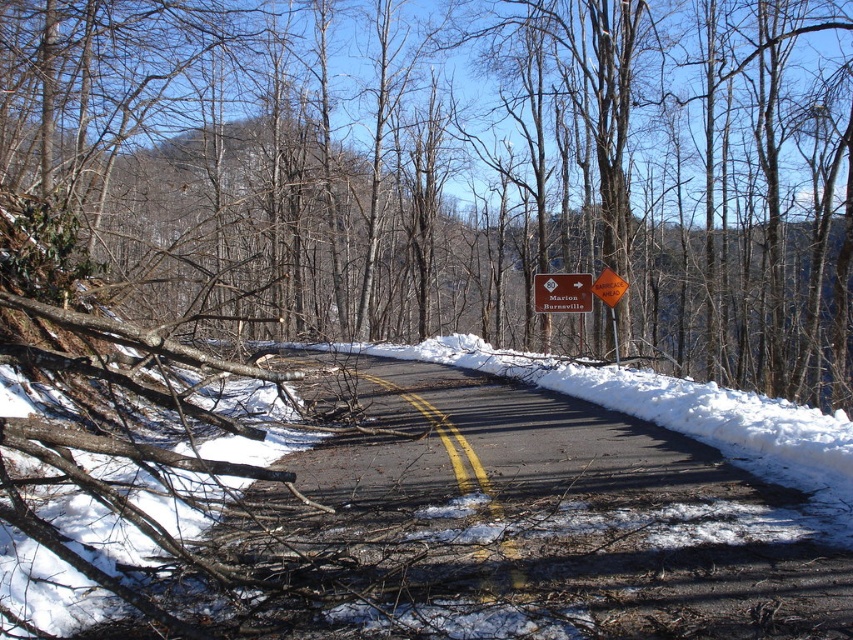
Based on the photo, does brown wooden sign at center have a lesser width compared to orange reflective diamond at center?

No.

Is point (573, 304) less distant than point (602, 291)?

No, (573, 304) is behind (602, 291).

Locate an element on the screen. The image size is (853, 640). brown wooden sign at center is located at coordinates (561, 292).

Can you confirm if white powdery snow at lower left is taller than orange reflective diamond at center?

Indeed, white powdery snow at lower left has a greater height compared to orange reflective diamond at center.

Is point (463, 588) in front of point (621, 289)?

Yes, it is.

Locate an element on the screen. The height and width of the screenshot is (640, 853). white powdery snow at lower left is located at coordinates (426, 525).

Consider the image. Can you confirm if white powdery snow at lower left is smaller than brown wooden sign at center?

Incorrect, white powdery snow at lower left is not smaller in size than brown wooden sign at center.

Measure the distance between white powdery snow at lower left and brown wooden sign at center.

white powdery snow at lower left and brown wooden sign at center are 9.80 meters apart.

At what (x,y) coordinates should I click in order to perform the action: click on white powdery snow at lower left. Please return your answer as a coordinate pair (x, y). This screenshot has height=640, width=853. Looking at the image, I should click on (426, 525).